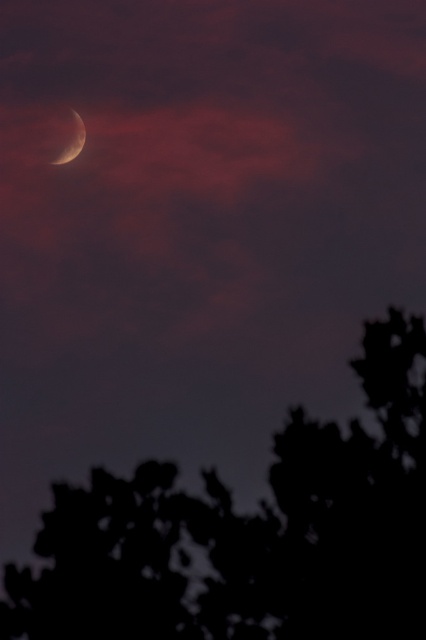
You are an astronomer observing the twilight sky. You notice the silhouette leafy tree at upper left and the satin silver crescent at upper left. Which object appears taller in the sky?

The silhouette leafy tree at upper left has a lesser height compared to the satin silver crescent at upper left, so the satin silver crescent at upper left appears taller in the sky.

From the picture: You are an astronomer observing the twilight sky. You notice a silhouette leafy tree at upper left and a satin silver crescent at upper left. Which celestial object is larger in the sky?

The satin silver crescent at upper left is larger in the sky than the silhouette leafy tree at upper left.

You are an astronomer observing the twilight sky. You notice a point at coordinates (252,532). What object is located at this point?

The point at coordinates (252,532) marks the silhouette leafy tree at upper left.